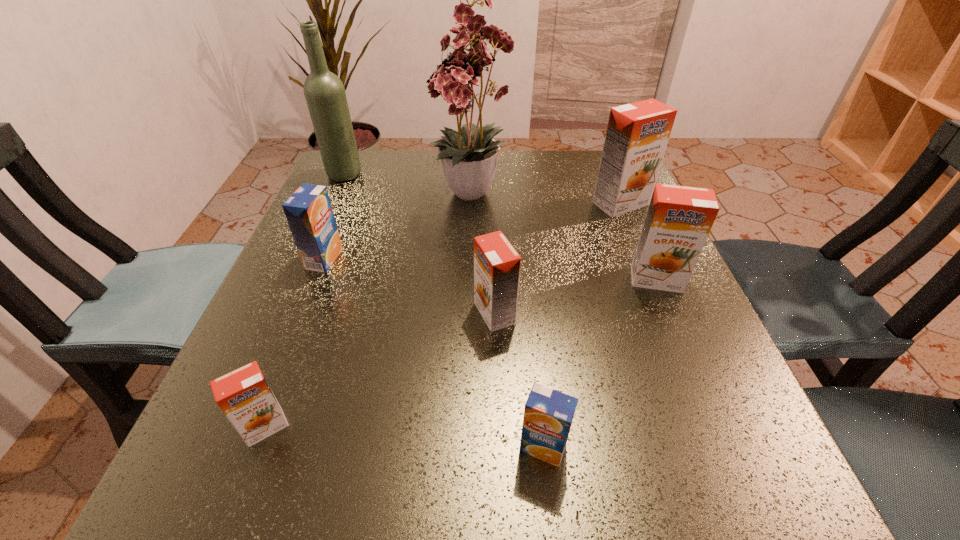
Identify the location of the third nearest orange juice. Image resolution: width=960 pixels, height=540 pixels. (497, 264).

This screenshot has height=540, width=960. Identify the location of the third farthest orange orange juice. (497, 264).

Where is `the right blue orange_juice`? This screenshot has width=960, height=540. the right blue orange_juice is located at coordinates (548, 414).

You are a GUI agent. You are given a task and a screenshot of the screen. Output one action in this format:
    pyautogui.click(x=<x>, y=<y>)
    Task: Click on the smaller blue orange_juice
    
    Given the screenshot: What is the action you would take?
    pyautogui.click(x=548, y=414)

Identify the location of the smallest orange orange juice. point(244,396).

Locate an element on the screen. The width and height of the screenshot is (960, 540). the leftmost orange orange juice is located at coordinates (244, 396).

What are the coordinates of `blank space located 0.190m on the front-facing side of the flower arrangement` in the screenshot? It's located at (471, 302).

Find the location of `vacant space located 0.220m on the right of the seventh shortest object`. vacant space located 0.220m on the right of the seventh shortest object is located at coordinates 451,175.

Locate an element on the screen. vacant area situated on the left of the third tallest object is located at coordinates (539, 204).

Find the location of a particular element. The image size is (960, 540). free space located on the left of the third nearest orange orange juice is located at coordinates (455, 279).